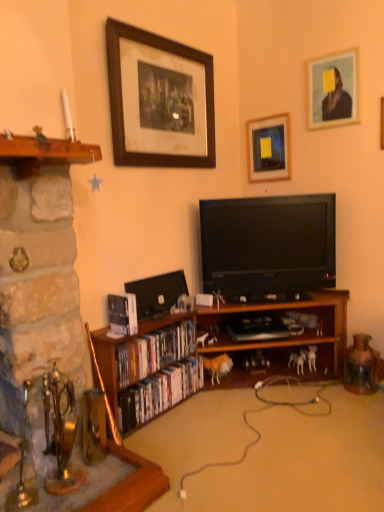
What are the coordinates of `vacant space underneath wooden bookshelf at center (from a real-world perspective)` in the screenshot? It's located at (246, 418).